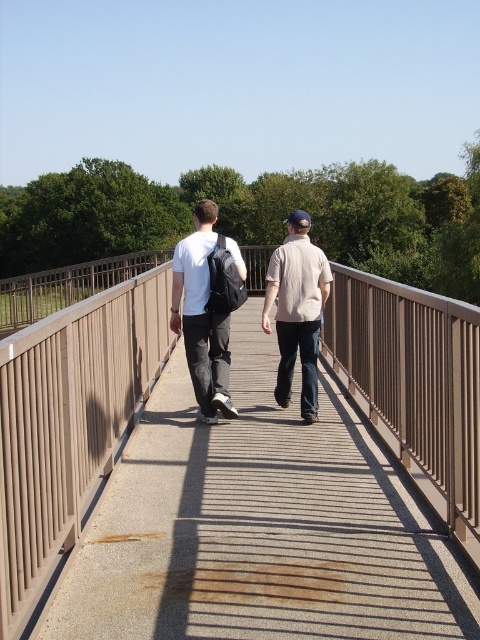
Between white matte backpack at center and beige cotton shirt at center, which one has less height?

beige cotton shirt at center is shorter.

Describe the element at coordinates (206, 308) in the screenshot. The width and height of the screenshot is (480, 640). I see `white matte backpack at center` at that location.

Locate an element on the screen. Image resolution: width=480 pixels, height=640 pixels. white matte backpack at center is located at coordinates (206, 308).

Locate an element on the screen. Image resolution: width=480 pixels, height=640 pixels. matte black backpack at center is located at coordinates pyautogui.click(x=207, y=307).

Who is more distant from viewer, (208, 259) or (228, 406)?

Point (228, 406)

Is point (195, 236) less distant than point (228, 352)?

Yes, point (195, 236) is closer to viewer.

The width and height of the screenshot is (480, 640). I want to click on matte black backpack at center, so click(x=207, y=307).

Can you confirm if brown textured bridge at center is positioned to the left of white matte backpack at center?

In fact, brown textured bridge at center is to the right of white matte backpack at center.

Where is `brown textured bridge at center`? brown textured bridge at center is located at coordinates (261, 525).

Where is `brown textured bridge at center`? This screenshot has width=480, height=640. brown textured bridge at center is located at coordinates (261, 525).